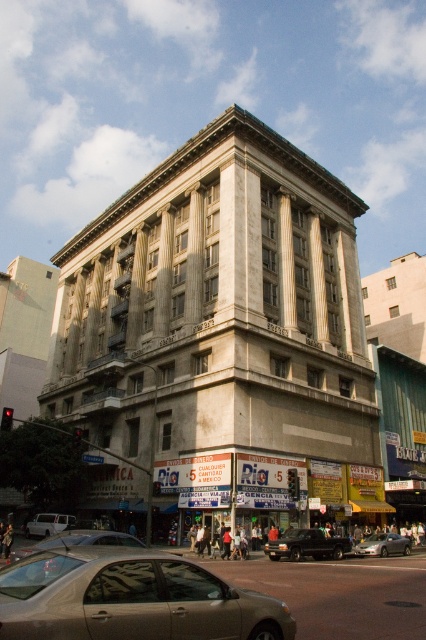
Between white stone pillar at center and satin silver car at center, which one appears on the right side from the viewer's perspective?

satin silver car at center

Does point (291, 380) come closer to viewer compared to point (402, 554)?

No.

What are the coordinates of `white stone pillar at center` in the screenshot? It's located at (221, 340).

Between silver metallic sedan at lower left and satin silver car at center, which one appears on the left side from the viewer's perspective?

silver metallic sedan at lower left is more to the left.

In the scene shown: Is silver metallic sedan at lower left wider than satin silver car at center?

Yes, silver metallic sedan at lower left is wider than satin silver car at center.

Looking at this image, measure the distance between point (x=132, y=544) and camera.

A distance of 33.90 meters exists between point (x=132, y=544) and camera.

Image resolution: width=426 pixels, height=640 pixels. I want to click on silver metallic sedan at lower left, so click(x=78, y=540).

Does silver metallic sedan at lower left have a greater width compared to silver metallic van at lower left?

Indeed, silver metallic sedan at lower left has a greater width compared to silver metallic van at lower left.

In the scene shown: Does silver metallic sedan at lower left appear under silver metallic van at lower left?

No, silver metallic sedan at lower left is not below silver metallic van at lower left.

Is point (14, 560) closer to viewer compared to point (43, 532)?

Yes, point (14, 560) is in front of point (43, 532).

Image resolution: width=426 pixels, height=640 pixels. What are the coordinates of `silver metallic sedan at lower left` in the screenshot? It's located at (78, 540).